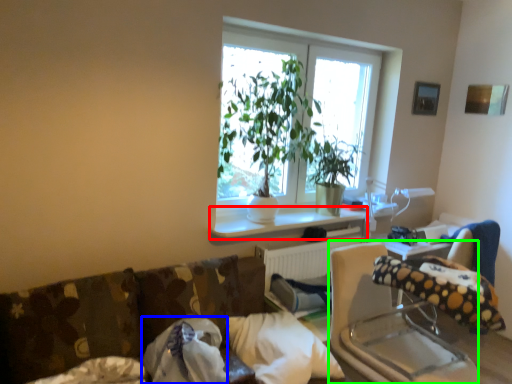
Question: Based on their relative distances, which object is nearer to window sill (highlighted by a red box)? Choose from pillow (highlighted by a blue box) and rocking chair (highlighted by a green box).

Choices:
 (A) pillow
 (B) rocking chair

Answer: (A)